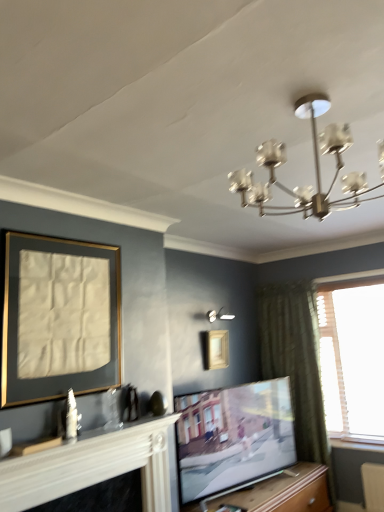
Locate an element on the screen. Image resolution: width=384 pixels, height=512 pixels. vacant space underneath matte black tv at center (from a real-world perspective) is located at coordinates (251, 489).